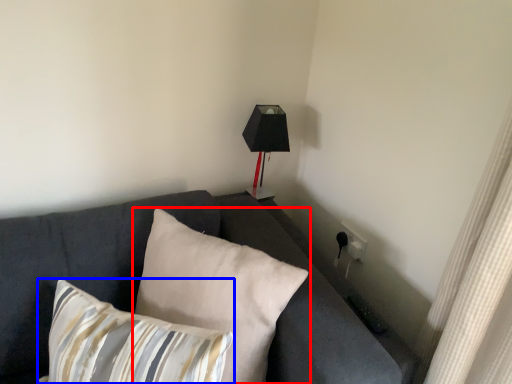
Question: Which point is closer to the camera, pillow (highlighted by a red box) or pillow (highlighted by a blue box)?

Choices:
 (A) pillow
 (B) pillow

Answer: (B)